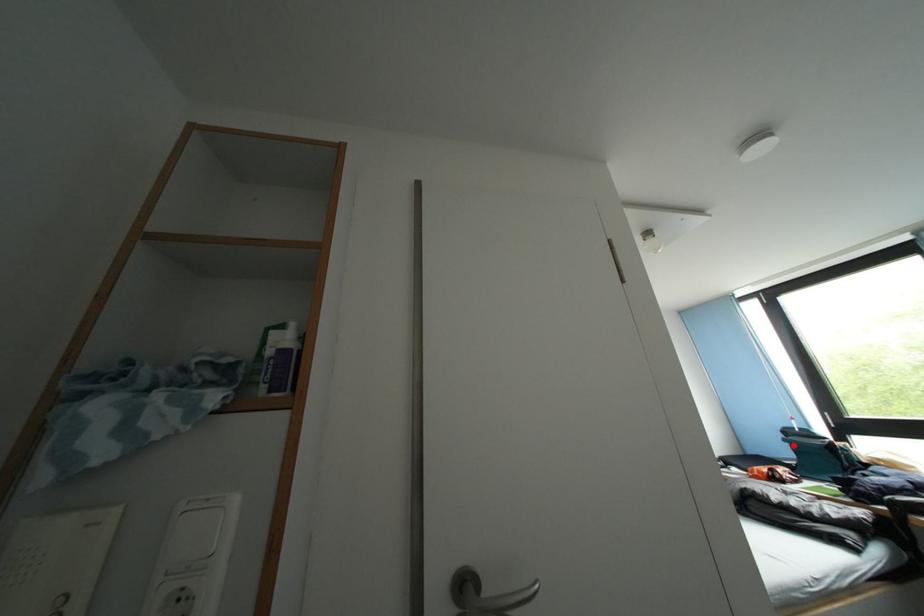
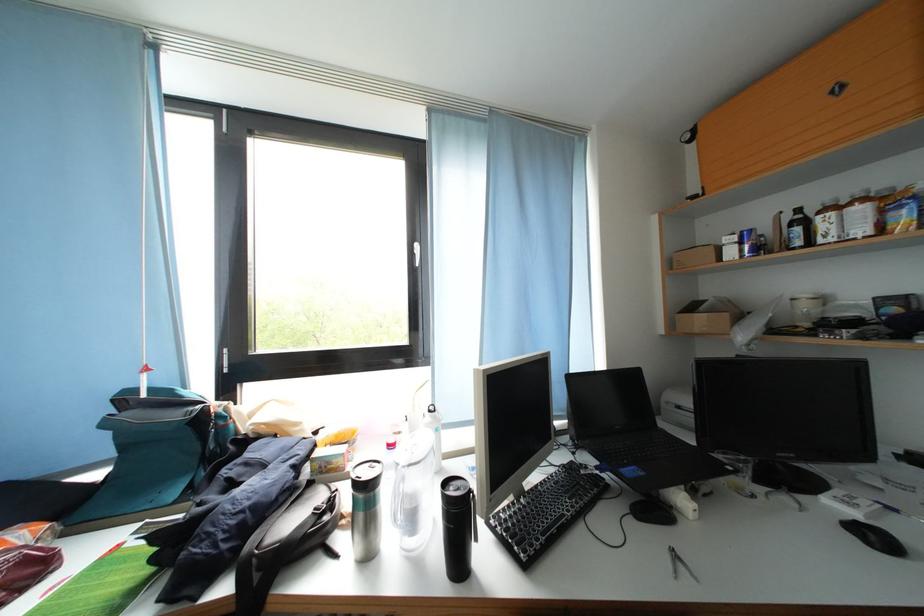
The point at the highlighted location is marked in the first image. Where is the corresponding point in the second image?

(114, 429)